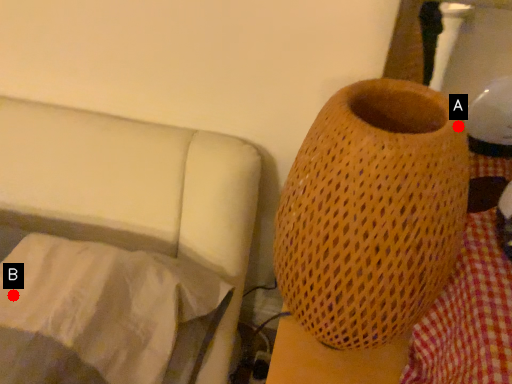
Question: Two points are circled on the image, labeled by A and B beside each circle. Which point is farther from the camera taking this photo?

Choices:
 (A) A is further
 (B) B is further

Answer: (B)